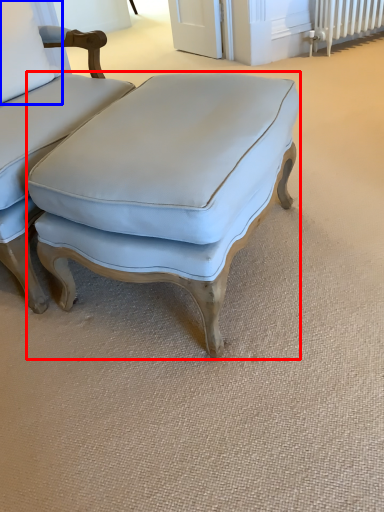
Question: Among these objects, which one is farthest to the camera, studio couch (highlighted by a red box) or pillow (highlighted by a blue box)?

Choices:
 (A) studio couch
 (B) pillow

Answer: (B)